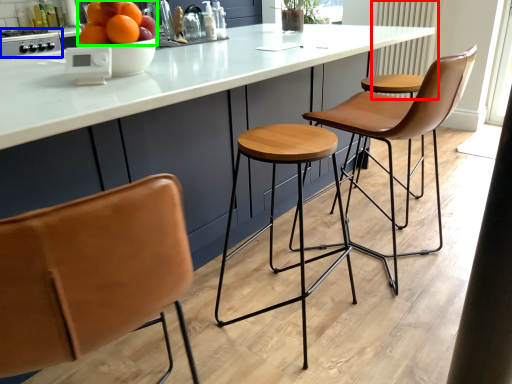
Question: Which is nearer to the radiator (highlighted by a red box)? appliance (highlighted by a blue box) or fruit (highlighted by a green box).

Choices:
 (A) appliance
 (B) fruit

Answer: (B)